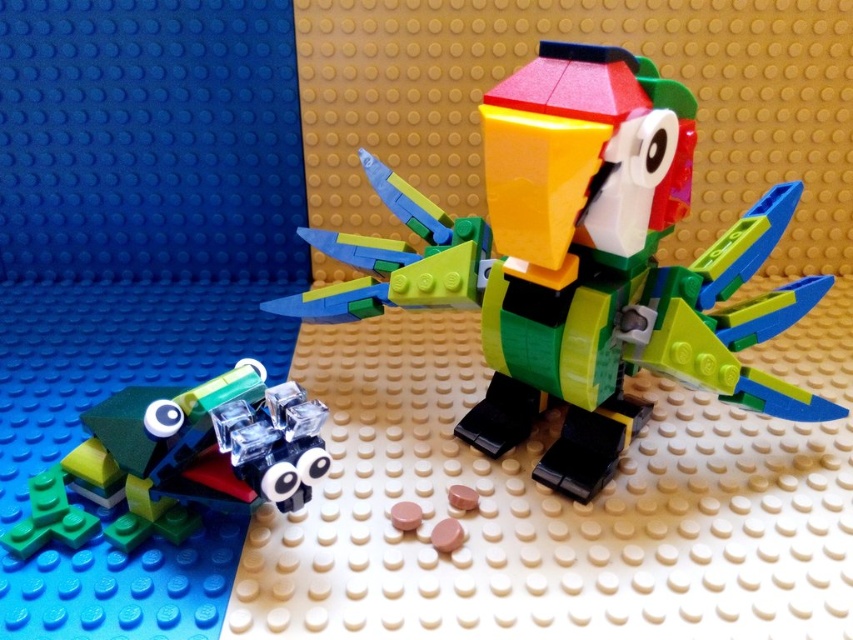
Does multicolored plastic parrot at center have a lesser width compared to translucent green plastic frog at lower left?

Incorrect, multicolored plastic parrot at center's width is not less than translucent green plastic frog at lower left's.

Between multicolored plastic parrot at center and translucent green plastic frog at lower left, which one has less height?

translucent green plastic frog at lower left is shorter.

Which is behind, point (669, 355) or point (32, 525)?

Positioned behind is point (32, 525).

The width and height of the screenshot is (853, 640). In order to click on multicolored plastic parrot at center in this screenshot , I will do `click(579, 264)`.